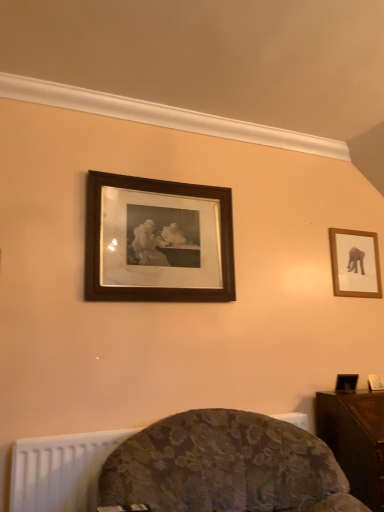
Question: Looking at their shapes, would you say wooden frame at upper right, the 1th picture frame when ordered from right to left, is wider or thinner than dark wood table at lower right?

Choices:
 (A) wide
 (B) thin

Answer: (B)

Question: Is point (344, 274) positioned closer to the camera than point (322, 406)?

Choices:
 (A) farther
 (B) closer

Answer: (A)

Question: Which of these objects is positioned closest to the velvet floral chair at lower center?

Choices:
 (A) dark wood table at lower right
 (B) wooden frame at upper right, the 2th picture frame when ordered from left to right
 (C) black wood picture frame at upper center, arranged as the 2th picture frame when viewed from the back

Answer: (A)

Question: Which is farther from the dark wood table at lower right?

Choices:
 (A) velvet floral chair at lower center
 (B) black wood picture frame at upper center, which appears as the 1th picture frame when viewed from the front
 (C) wooden frame at upper right, which is the first picture frame from back to front

Answer: (B)